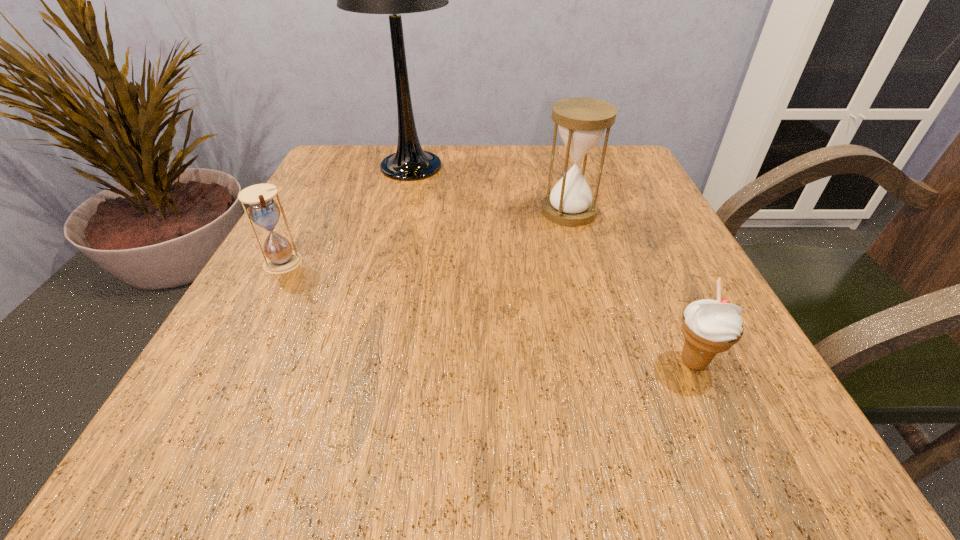
Find the location of `vacant space located 0.310m on the front of the shorter hourglass`. vacant space located 0.310m on the front of the shorter hourglass is located at coordinates (181, 452).

Identify the location of free location located on the back of the shortest object. This screenshot has height=540, width=960. [x=665, y=299].

Locate an element on the screen. Image resolution: width=960 pixels, height=540 pixels. object that is at the far edge is located at coordinates (410, 162).

Identify the location of table lamp that is at the left edge. This screenshot has height=540, width=960. (410, 162).

Identify the location of hourglass that is at the left edge. (263, 210).

Locate an element on the screen. The height and width of the screenshot is (540, 960). hourglass at the right edge is located at coordinates (581, 121).

Locate an element on the screen. icecream located in the right edge section of the desktop is located at coordinates click(x=709, y=326).

This screenshot has height=540, width=960. Find the location of `object at the far left corner`. object at the far left corner is located at coordinates (410, 162).

Where is `free space at the far edge of the desktop`? free space at the far edge of the desktop is located at coordinates (459, 191).

Where is `free space at the near edge of the desktop`? Image resolution: width=960 pixels, height=540 pixels. free space at the near edge of the desktop is located at coordinates (660, 470).